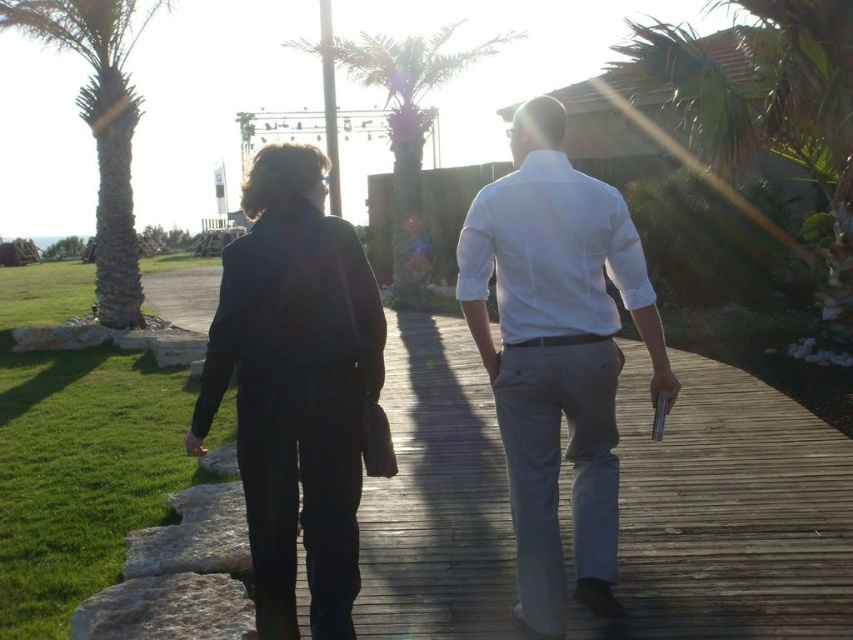
Consider the image. Can you confirm if dark blue suit at center is wider than dark blue fabric jacket at left?

Correct, the width of dark blue suit at center exceeds that of dark blue fabric jacket at left.

Is point (590, 545) closer to viewer compared to point (321, 561)?

That is False.

Where is `dark blue suit at center`? The height and width of the screenshot is (640, 853). dark blue suit at center is located at coordinates (556, 355).

Can you confirm if dark blue suit at center is smaller than green leafy palm tree at left?

Actually, dark blue suit at center might be larger than green leafy palm tree at left.

Which of these two, dark blue suit at center or green leafy palm tree at left, stands shorter?

With less height is green leafy palm tree at left.

Describe the element at coordinates (556, 355) in the screenshot. I see `dark blue suit at center` at that location.

You are a GUI agent. You are given a task and a screenshot of the screen. Output one action in this format:
    pyautogui.click(x=<x>, y=<y>)
    Task: Click on the dark blue suit at center
    Image resolution: width=853 pixels, height=640 pixels.
    Given the screenshot: What is the action you would take?
    pyautogui.click(x=556, y=355)

Which is behind, point (535, 596) or point (329, 358)?

The point (535, 596) is behind.

Who is more forward, (509, 260) or (228, 321)?

Point (228, 321)

Where is `white cotton shirt at center`? The width and height of the screenshot is (853, 640). white cotton shirt at center is located at coordinates (556, 355).